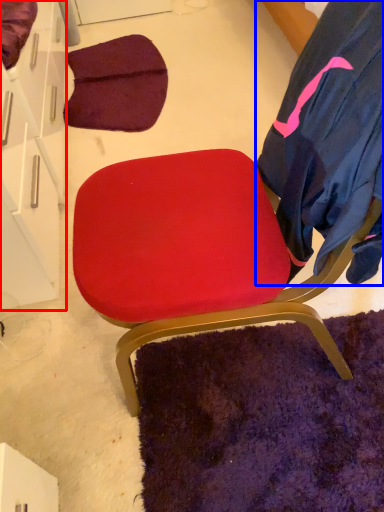
Question: Among these objects, which one is nearest to the camera, drawer (highlighted by a red box) or robe (highlighted by a blue box)?

Choices:
 (A) drawer
 (B) robe

Answer: (B)